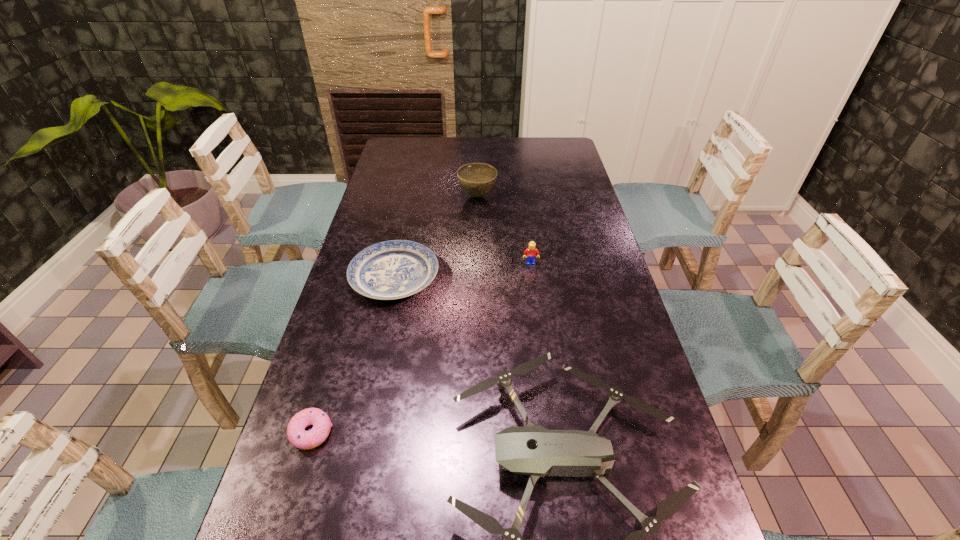
You are a GUI agent. You are given a task and a screenshot of the screen. Output one action in this format:
    pyautogui.click(x=<x>, y=<y>)
    Task: Click on the third closest object relative to the doughnut
    
    Given the screenshot: What is the action you would take?
    pyautogui.click(x=531, y=253)

At what (x,y) coordinates should I click in order to perform the action: click on vacant space that satisfies the following two spatial constraints: 1. on the back side of the farthest object; 2. on the right side of the plate. Please return your answer as a coordinate pair (x, y). Looking at the image, I should click on point(412,196).

At what (x,y) coordinates should I click in order to perform the action: click on vacant space that satisfies the following two spatial constraints: 1. on the back side of the plate; 2. on the left side of the tallest object. Please return your answer as a coordinate pair (x, y). The image size is (960, 540). Looking at the image, I should click on (412, 196).

You are a GUI agent. You are given a task and a screenshot of the screen. Output one action in this format:
    pyautogui.click(x=<x>, y=<y>)
    Task: Click on the vacant space that satisfies the following two spatial constraints: 1. on the back side of the doughnut; 2. on the right side of the bowl
    This screenshot has height=540, width=960.
    Given the screenshot: What is the action you would take?
    pyautogui.click(x=383, y=196)

Where is `free space that satisfies the following two spatial constraints: 1. on the back side of the doughnut; 2. on the left side of the farthest object`? The width and height of the screenshot is (960, 540). free space that satisfies the following two spatial constraints: 1. on the back side of the doughnut; 2. on the left side of the farthest object is located at coordinates (383, 196).